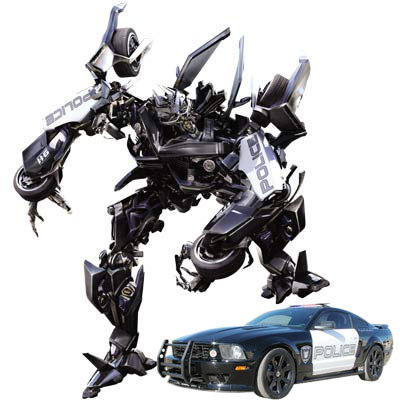
Find the location of a particular element. This screenshot has height=400, width=400. window is located at coordinates (336, 317), (363, 324).